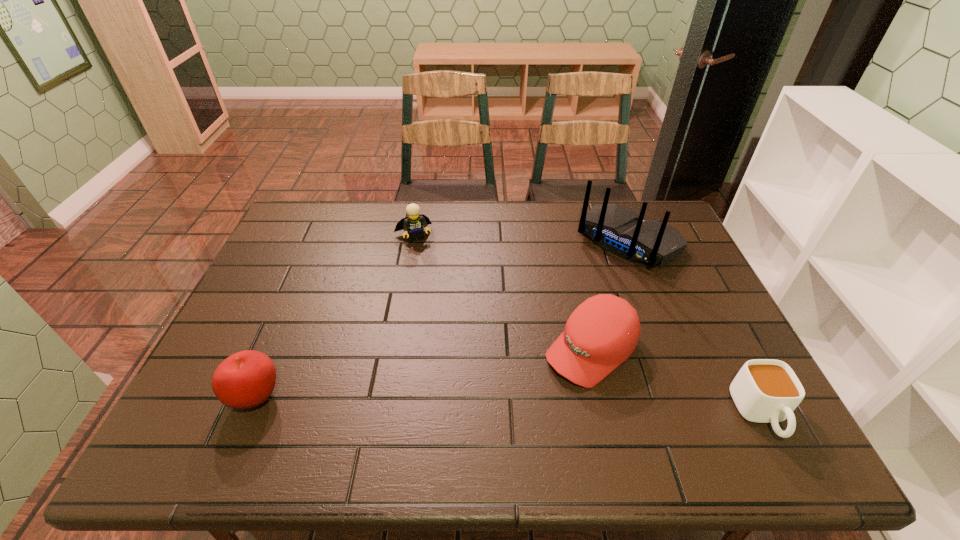
Locate an element on the screen. This screenshot has width=960, height=540. vacant space situated on the front-facing side of the Lego is located at coordinates (430, 275).

You are a GUI agent. You are given a task and a screenshot of the screen. Output one action in this format:
    pyautogui.click(x=<x>, y=<y>)
    Task: Click on the vacant space located 0.350m on the front-facing side of the Lego
    
    Given the screenshot: What is the action you would take?
    pyautogui.click(x=449, y=322)

Locate an element on the screen. free point located on the back of the tallest object is located at coordinates (547, 319).

Locate an element on the screen. This screenshot has width=960, height=540. vacant space situated 0.090m on the back of the tallest object is located at coordinates (586, 281).

Where is `vacant space located 0.140m on the back of the tallest object`? vacant space located 0.140m on the back of the tallest object is located at coordinates (577, 290).

The height and width of the screenshot is (540, 960). I want to click on Lego at the far edge, so click(x=414, y=223).

In order to click on router located at the far edge in this screenshot , I will do `click(616, 229)`.

Where is `apple that is positioned at the near edge`? This screenshot has width=960, height=540. apple that is positioned at the near edge is located at coordinates (246, 379).

Identify the location of cup present at the near edge. (765, 390).

In order to click on cap present at the near edge in this screenshot , I will do `click(602, 332)`.